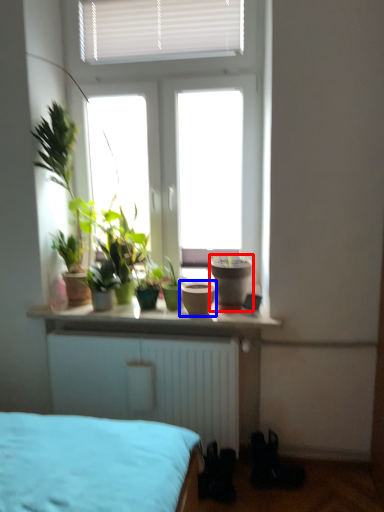
Question: Which of the following is the farthest to the observer, flowerpot (highlighted by a red box) or flowerpot (highlighted by a blue box)?

Choices:
 (A) flowerpot
 (B) flowerpot

Answer: (A)